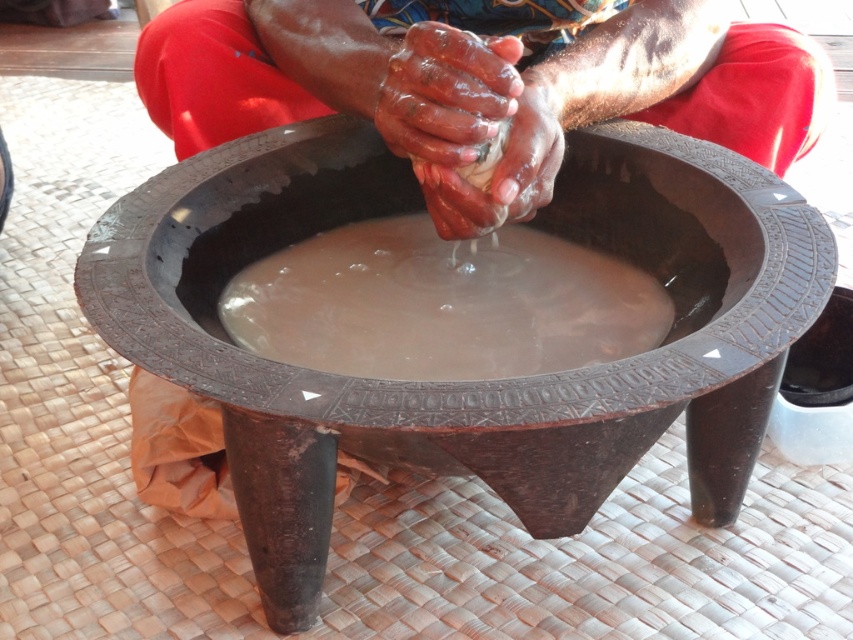
Question: Observing the image, what is the correct spatial positioning of carved wooden bowl at center in reference to smooth clay mud at center?

Choices:
 (A) below
 (B) above

Answer: (A)

Question: Which point is farther to the camera?

Choices:
 (A) (494, 352)
 (B) (477, 422)

Answer: (A)

Question: Can you confirm if smooth clay hands at center is positioned to the right of smooth clay mud at center?

Choices:
 (A) yes
 (B) no

Answer: (A)

Question: Does carved wooden bowl at center appear on the left side of smooth clay hands at center?

Choices:
 (A) yes
 (B) no

Answer: (A)

Question: Among these objects, which one is nearest to the camera?

Choices:
 (A) smooth clay hands at center
 (B) smooth clay mud at center
 (C) carved wooden bowl at center

Answer: (C)

Question: Which object appears farthest from the camera in this image?

Choices:
 (A) carved wooden bowl at center
 (B) smooth clay hands at center
 (C) smooth clay mud at center

Answer: (C)